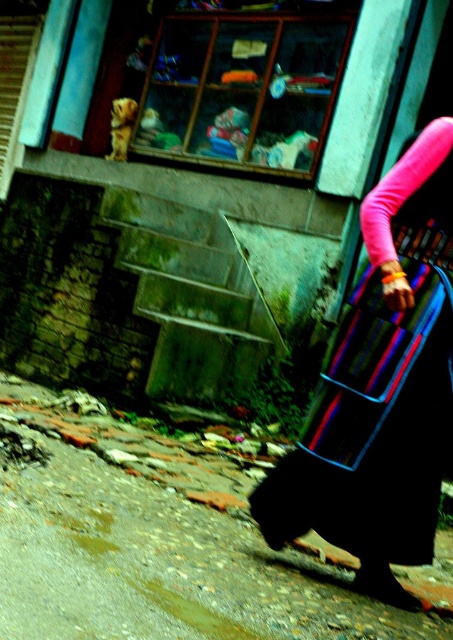
Question: Does brick pavement at lower left appear over multicolored woven bag at right?

Choices:
 (A) yes
 (B) no

Answer: (B)

Question: Is brick pavement at lower left smaller than multicolored woven bag at right?

Choices:
 (A) yes
 (B) no

Answer: (B)

Question: Which point is farther to the camera?

Choices:
 (A) (321, 401)
 (B) (94, 593)

Answer: (A)

Question: Which point is closer to the camera taking this photo?

Choices:
 (A) (379, 403)
 (B) (245, 577)

Answer: (A)

Question: Can you confirm if brick pavement at lower left is positioned to the right of multicolored woven bag at right?

Choices:
 (A) yes
 (B) no

Answer: (B)